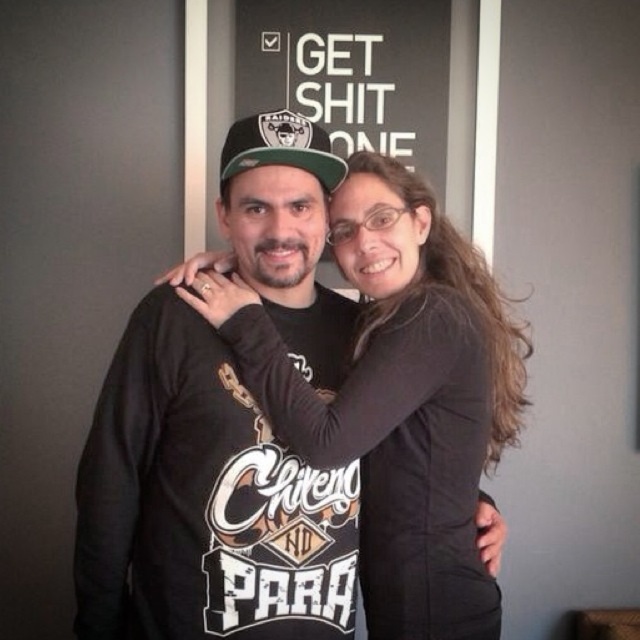
In the scene shown: You are a fashion designer who wants to create a new outfit based on the image. You need to know the spatial relationship between the black matte shirt at center and the camo fabric baseball cap at center. Which one is positioned lower?

The black matte shirt at center is positioned lower than the camo fabric baseball cap at center, as it is located below it.

You are a photographer setting up for a portrait. You have a camera with a 50mm lens and want to ensure both the black matte shirt at center and the camo fabric baseball cap at center are in focus. The depth of field at this lens setting allows objects within 12 inches of the focal point to be sharp. Where should you focus to capture both items clearly?

You should focus on the midpoint between the black matte shirt at center and the camo fabric baseball cap at center since they are 14.20 inches apart, which exceeds the 12 inch depth of field. By focusing halfway, both items will fall within the acceptable sharpness range.

You are a photographer holding a camera and want to take a portrait of the black matte shirt at center. What is the minimum distance you should stand from the subject to capture a clear photo?

The minimum distance you should stand from the black matte shirt at center is 3.90 feet to ensure a clear photo.